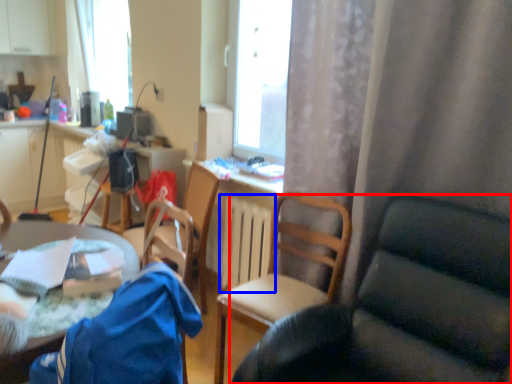
Question: Which object appears closest to the camera in this image, chair (highlighted by a red box) or radiator (highlighted by a blue box)?

Choices:
 (A) chair
 (B) radiator

Answer: (A)